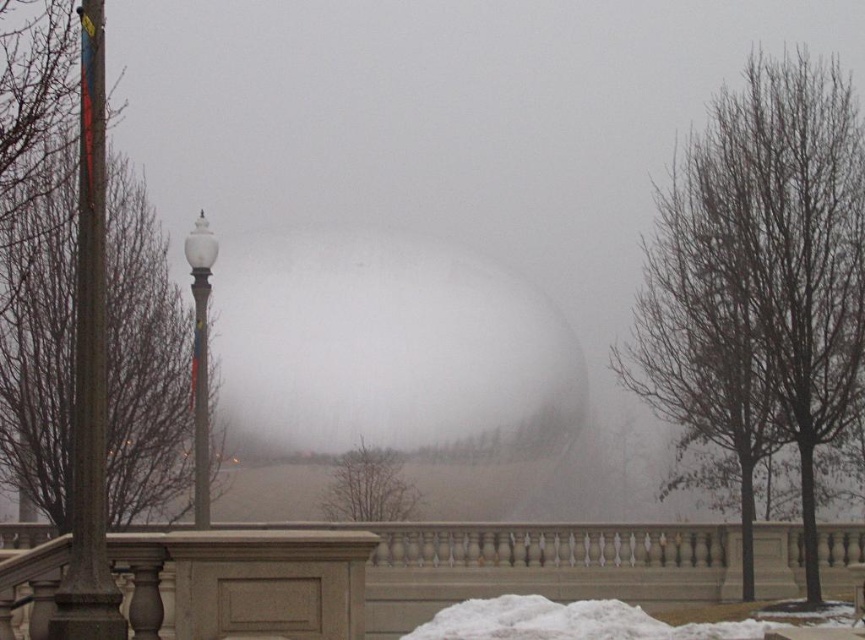
Question: Does bare wood tree at right appear on the right side of metallic pole at left?

Choices:
 (A) yes
 (B) no

Answer: (A)

Question: Does brown leafless tree at left have a greater width compared to bare branches at center?

Choices:
 (A) no
 (B) yes

Answer: (B)

Question: Which object appears farthest from the camera in this image?

Choices:
 (A) white fluffy snow at lower center
 (B) brown leafless tree at left
 (C) metallic gray pole at center
 (D) bare wood tree at right

Answer: (D)

Question: Which object appears closest to the camera in this image?

Choices:
 (A) white glossy lamp post at left
 (B) brown leafless tree at left

Answer: (B)

Question: Which point is farther to the camera?

Choices:
 (A) (420, 548)
 (B) (97, 154)
 (C) (196, 316)
 (D) (767, 182)

Answer: (A)

Question: Is white matte fog at center behind brown leafless tree at left?

Choices:
 (A) no
 (B) yes

Answer: (B)